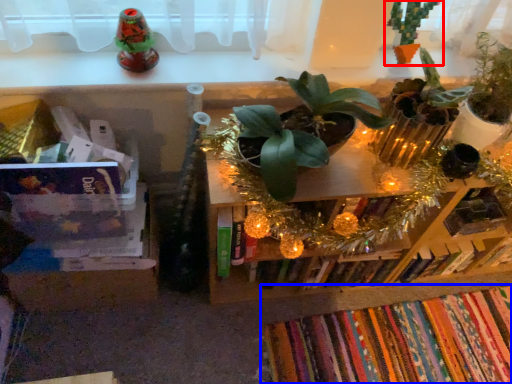
Question: Among these objects, which one is nearest to the camera, houseplant (highlighted by a red box) or book (highlighted by a blue box)?

Choices:
 (A) houseplant
 (B) book

Answer: (A)